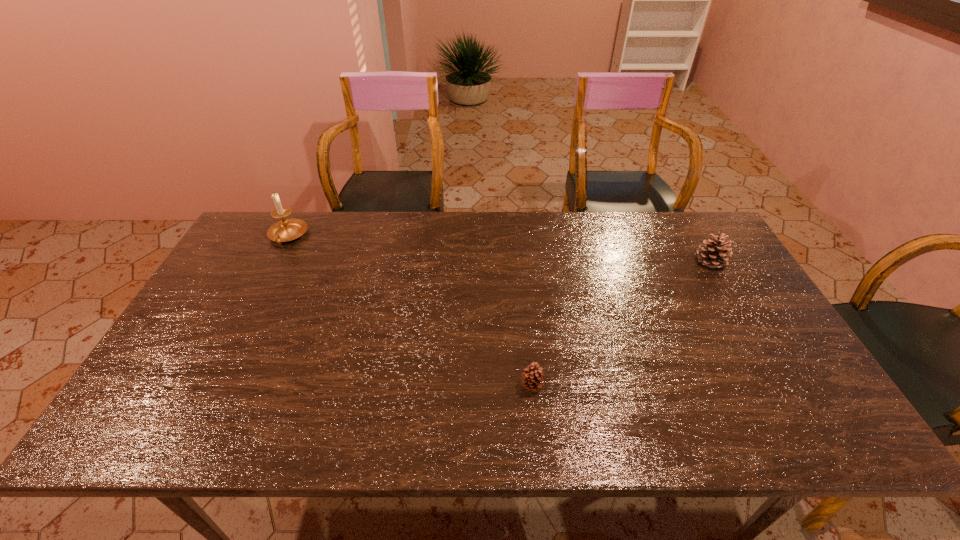
Locate an element on the screen. pinecone located at the far edge is located at coordinates (715, 254).

The height and width of the screenshot is (540, 960). Find the location of `object at the left edge`. object at the left edge is located at coordinates (285, 230).

This screenshot has width=960, height=540. Find the location of `object present at the right edge`. object present at the right edge is located at coordinates (715, 254).

Find the location of a particular element. This screenshot has width=960, height=540. object located at the far left corner is located at coordinates [285, 230].

Locate an element on the screen. The width and height of the screenshot is (960, 540). object that is positioned at the far right corner is located at coordinates (715, 254).

Where is `blank area at the far edge`? blank area at the far edge is located at coordinates (388, 226).

Where is `free space at the near edge`? free space at the near edge is located at coordinates (632, 426).

Identify the location of vacant point at the left edge. (193, 329).

The height and width of the screenshot is (540, 960). Find the location of `vacant area at the right edge`. vacant area at the right edge is located at coordinates (750, 287).

In the image, there is a desktop. Where is `free space at the near right corner`? This screenshot has width=960, height=540. free space at the near right corner is located at coordinates (834, 442).